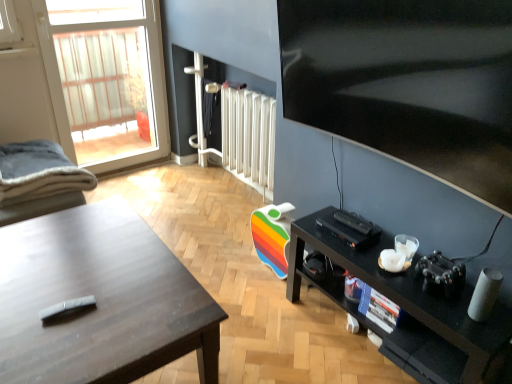
Question: Does matte black desk at left appear on the left side of metallic silver screen door at upper center?

Choices:
 (A) no
 (B) yes

Answer: (B)

Question: Is matte black desk at left outside metallic silver screen door at upper center?

Choices:
 (A) no
 (B) yes

Answer: (B)

Question: Considering the relative sizes of matte black desk at left and metallic silver screen door at upper center in the image provided, is matte black desk at left shorter than metallic silver screen door at upper center?

Choices:
 (A) yes
 (B) no

Answer: (B)

Question: From a real-world perspective, does matte black desk at left stand above metallic silver screen door at upper center?

Choices:
 (A) no
 (B) yes

Answer: (A)

Question: Could you tell me if matte black desk at left is facing metallic silver screen door at upper center?

Choices:
 (A) no
 (B) yes

Answer: (A)

Question: Does point (202, 74) appear closer or farther from the camera than point (57, 130)?

Choices:
 (A) closer
 (B) farther

Answer: (B)

Question: Which is correct: metallic silver screen door at upper center is inside transparent glass door at upper left, or outside of it?

Choices:
 (A) inside
 (B) outside

Answer: (B)

Question: From a real-world perspective, is metallic silver screen door at upper center above or below transparent glass door at upper left?

Choices:
 (A) above
 (B) below

Answer: (B)

Question: In terms of height, does metallic silver screen door at upper center look taller or shorter compared to transparent glass door at upper left?

Choices:
 (A) tall
 (B) short

Answer: (B)

Question: Is matte black desk at left to the left or to the right of white glossy radiator at center in the image?

Choices:
 (A) right
 (B) left

Answer: (B)

Question: Is matte black desk at left situated inside white glossy radiator at center or outside?

Choices:
 (A) outside
 (B) inside

Answer: (A)

Question: From the image's perspective, is matte black desk at left located above or below white glossy radiator at center?

Choices:
 (A) below
 (B) above

Answer: (A)

Question: Considering the positions of matte black desk at left and white glossy radiator at center in the image, is matte black desk at left bigger or smaller than white glossy radiator at center?

Choices:
 (A) big
 (B) small

Answer: (A)

Question: From their relative heights in the image, would you say transparent glass door at upper left is taller or shorter than matte black desk at left?

Choices:
 (A) tall
 (B) short

Answer: (A)

Question: Looking at their shapes, would you say transparent glass door at upper left is wider or thinner than matte black desk at left?

Choices:
 (A) thin
 (B) wide

Answer: (A)